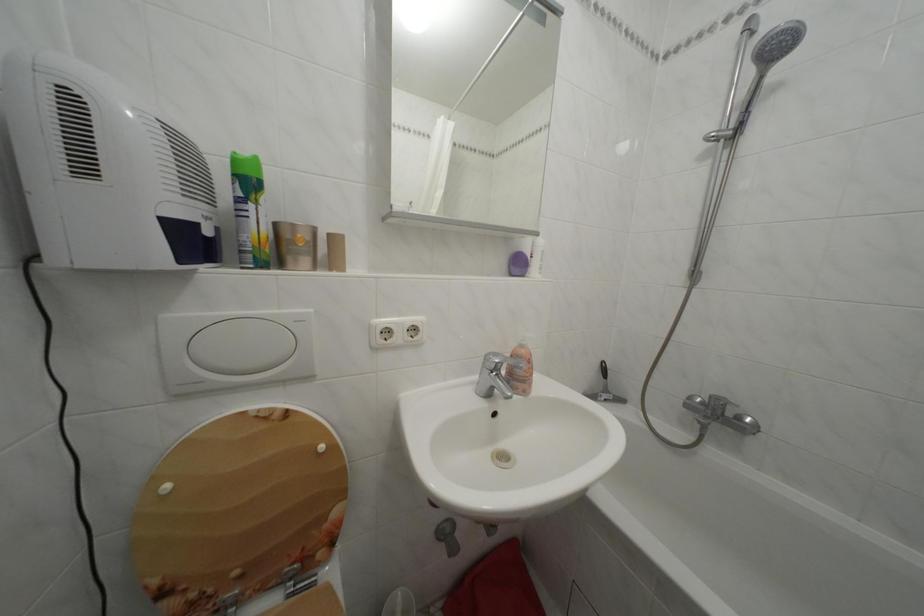
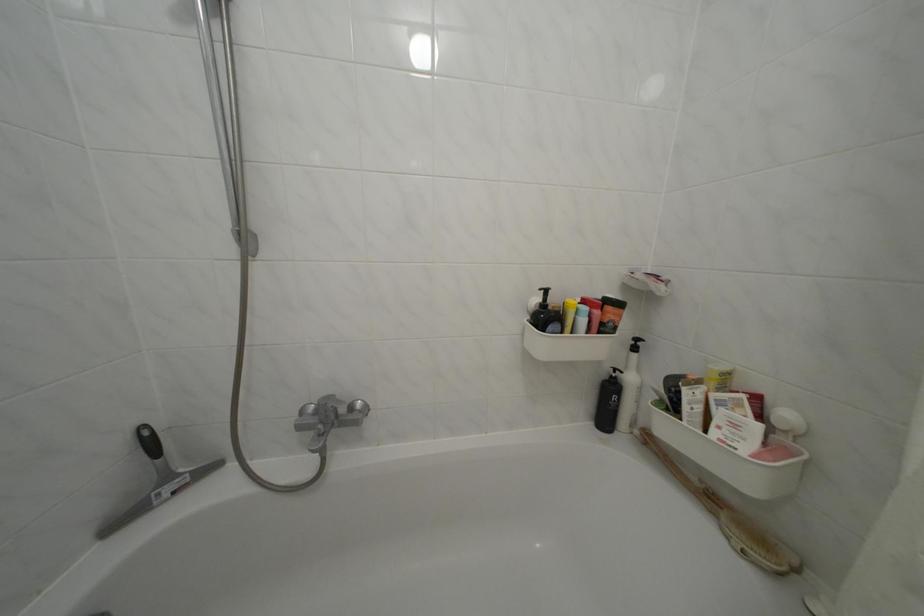
Where in the second image is the point corresponding to the point at 614,397 from the first image?

(176, 484)